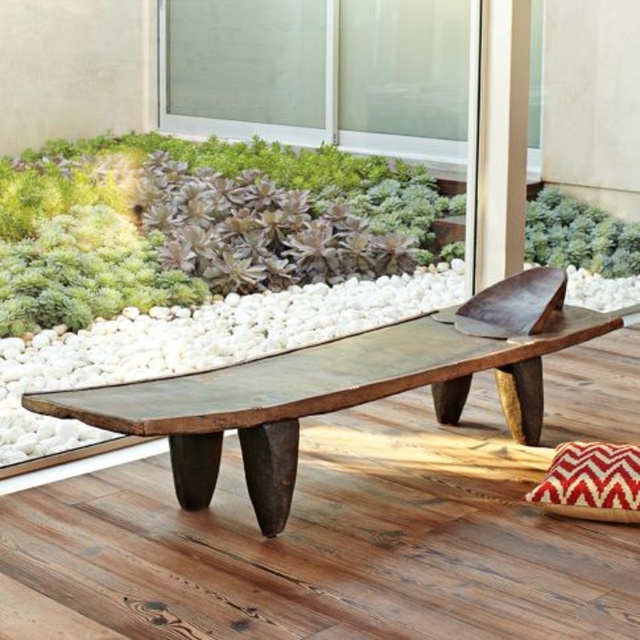
Can you confirm if rustic wood bench at center is shorter than green leafy plant at center?

In fact, rustic wood bench at center may be taller than green leafy plant at center.

Which is above, rustic wood bench at center or green leafy plant at center?

Positioned higher is green leafy plant at center.

What do you see at coordinates (337, 388) in the screenshot? The height and width of the screenshot is (640, 640). I see `rustic wood bench at center` at bounding box center [337, 388].

Where is `rustic wood bench at center`? Image resolution: width=640 pixels, height=640 pixels. rustic wood bench at center is located at coordinates (337, 388).